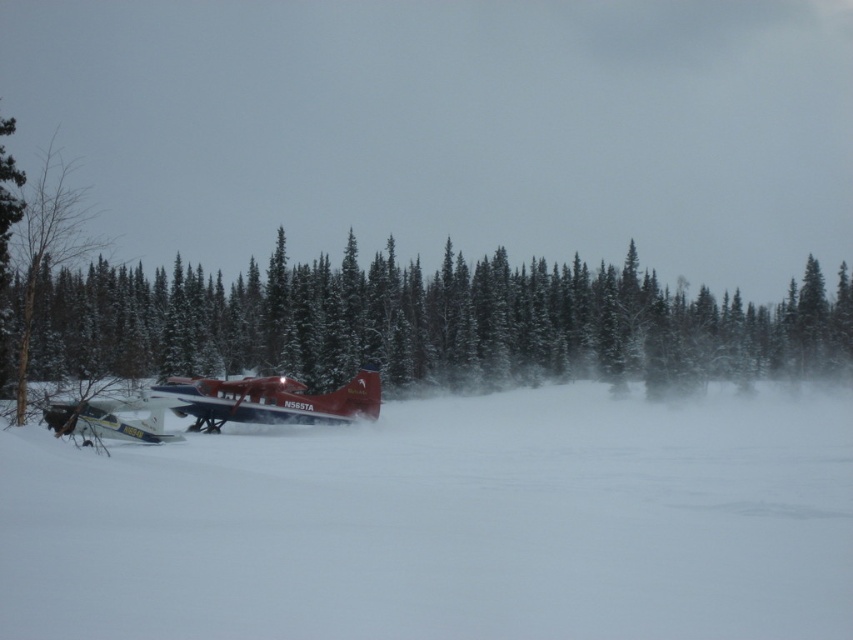
Question: Is the position of white fluffy snow at center less distant than that of green textured pine tree at center?

Choices:
 (A) no
 (B) yes

Answer: (B)

Question: Is white fluffy snow at center thinner than white matte airplane at lower left?

Choices:
 (A) yes
 (B) no

Answer: (B)

Question: Estimate the real-world distances between objects in this image. Which object is farther from the green textured pine tree at center?

Choices:
 (A) metallic blue airplane at center
 (B) white fluffy snow at center

Answer: (A)

Question: Which object is farther from the camera taking this photo?

Choices:
 (A) metallic blue airplane at center
 (B) green textured pine tree at center
 (C) white fluffy snow at center

Answer: (A)

Question: Which point is farther to the camera?

Choices:
 (A) coord(264,396)
 (B) coord(465,442)

Answer: (A)

Question: Can you confirm if green textured pine tree at center is positioned to the left of white matte airplane at lower left?

Choices:
 (A) yes
 (B) no

Answer: (B)